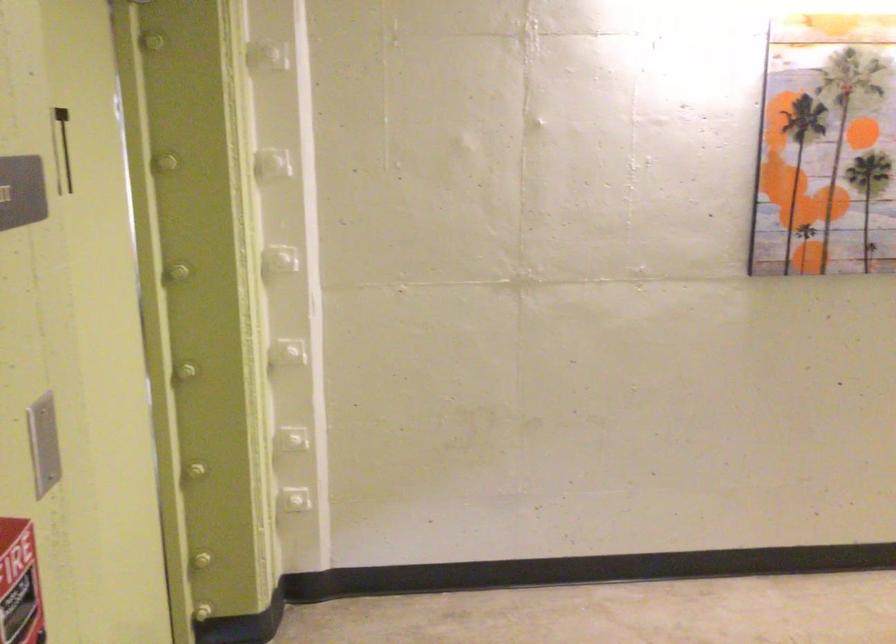
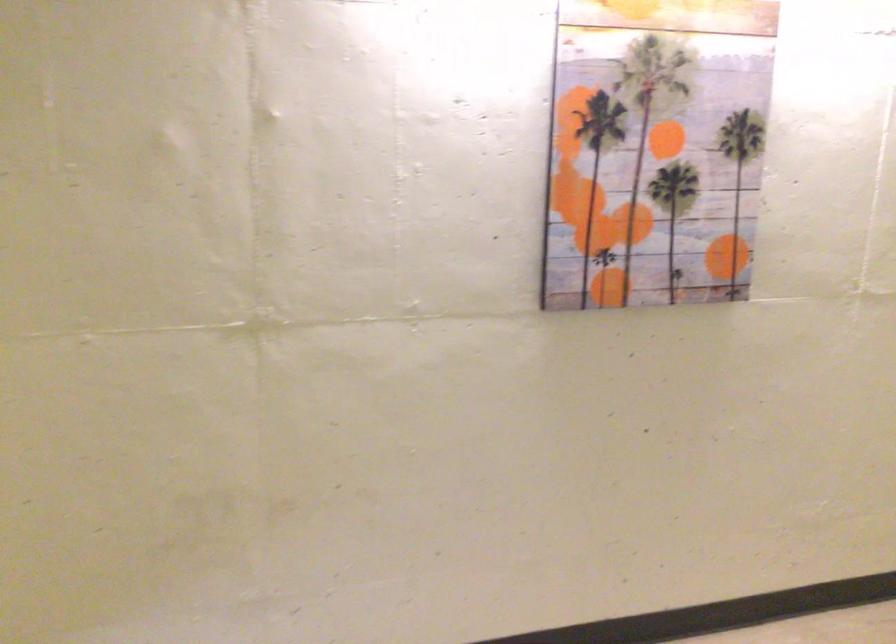
Question: Which direction would the cameraman need to move to produce the second image? Reply with the corresponding letter.

Choices:
 (A) Left
 (B) Right
 (C) Forward
 (D) Backward

Answer: (C)